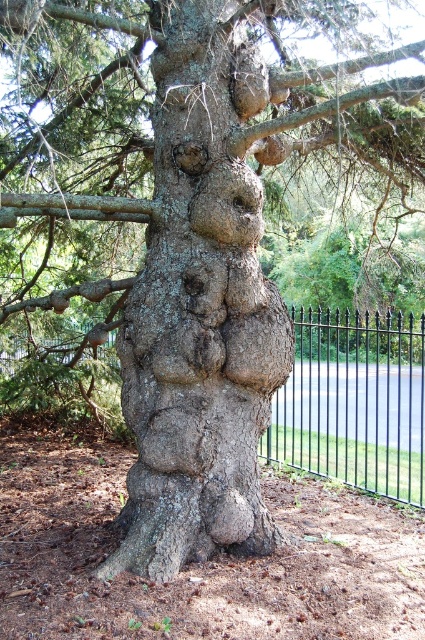
Question: Which point is farther from the camera taking this photo?

Choices:
 (A) [x=348, y=472]
 (B) [x=218, y=10]

Answer: (A)

Question: Which point appears closest to the camera in this image?

Choices:
 (A) (359, 333)
 (B) (212, 289)

Answer: (B)

Question: Does gray rough bark tree trunk at center lie in front of black wrought iron fence at center?

Choices:
 (A) yes
 (B) no

Answer: (A)

Question: Can you confirm if gray rough bark tree trunk at center is bigger than black wrought iron fence at center?

Choices:
 (A) no
 (B) yes

Answer: (A)

Question: Considering the relative positions of gray rough bark tree trunk at center and black wrought iron fence at center in the image provided, where is gray rough bark tree trunk at center located with respect to black wrought iron fence at center?

Choices:
 (A) left
 (B) right

Answer: (A)